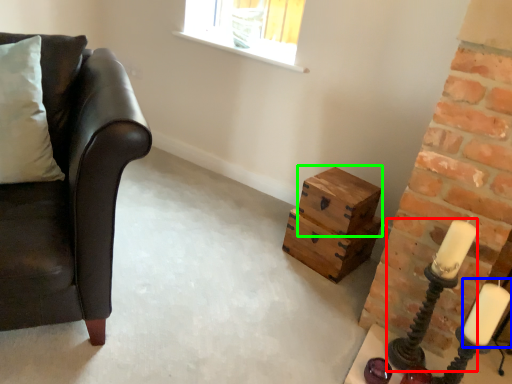
Question: Considering the real-world distances, which object is farthest from candle holder (highlighted by a red box)? candle (highlighted by a blue box) or box (highlighted by a green box)?

Choices:
 (A) candle
 (B) box

Answer: (B)